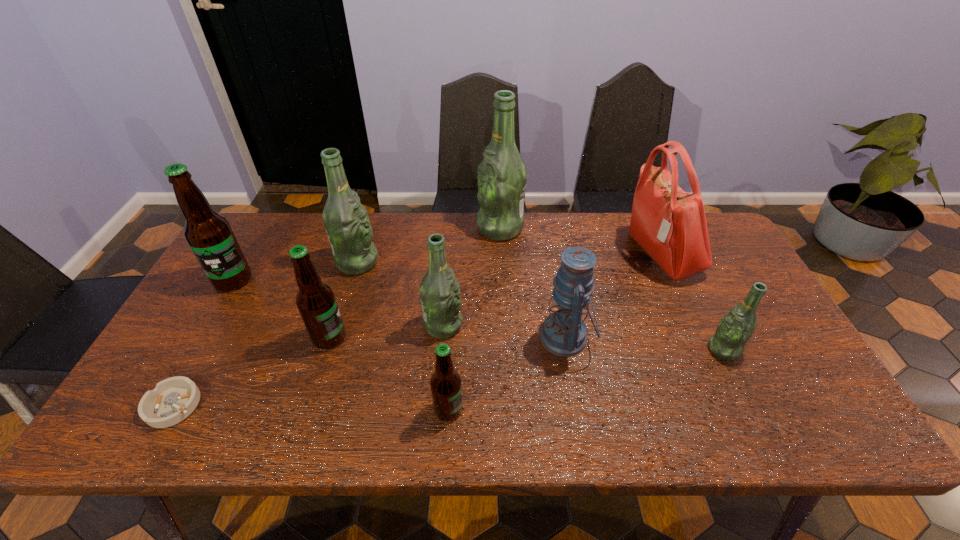
The width and height of the screenshot is (960, 540). In order to click on free space located 0.310m on the surface of the smallest green beer bottle in this screenshot , I will do `click(586, 349)`.

This screenshot has width=960, height=540. Identify the location of vacant area situated 0.240m on the surface of the smallest green beer bottle. coord(613,349).

At what (x,y) coordinates should I click in order to perform the action: click on free spot located 0.140m on the surface of the smallest green beer bottle. Please return your answer as a coordinate pair (x, y). This screenshot has height=540, width=960. Looking at the image, I should click on [x=653, y=349].

You are a GUI agent. You are given a task and a screenshot of the screen. Output one action in this format:
    pyautogui.click(x=<x>, y=<y>)
    Task: Click on the vacant space located on the back of the ashtray
    Image resolution: width=960 pixels, height=540 pixels.
    Given the screenshot: What is the action you would take?
    pyautogui.click(x=220, y=322)

The width and height of the screenshot is (960, 540). Identify the location of handbag present at the far edge. pos(670,224).

Where is `beer bottle that is positioned at the near edge`? The width and height of the screenshot is (960, 540). beer bottle that is positioned at the near edge is located at coordinates (446, 388).

Image resolution: width=960 pixels, height=540 pixels. Find the location of `ashtray that is at the near edge`. ashtray that is at the near edge is located at coordinates (172, 400).

In order to click on beer bottle that is positioned at the left edge in this screenshot , I will do `click(209, 235)`.

What are the coordinates of `ashtray positioned at the left edge` in the screenshot? It's located at (172, 400).

At what (x,y) coordinates should I click in order to perform the action: click on handbag located in the right edge section of the desktop. Please return your answer as a coordinate pair (x, y). The image size is (960, 540). Looking at the image, I should click on (670, 224).